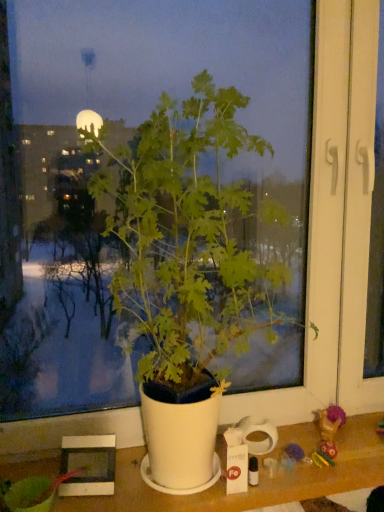
Describe the element at coordinates (188, 268) in the screenshot. I see `green matte plant at center` at that location.

This screenshot has width=384, height=512. I want to click on green matte plant at center, so click(188, 268).

In the scene shown: In order to face green matte plant at center, should I rotate leftwards or rightwards?

It's best to rotate right around 2.167 degrees.

Where is `green matte plant at center`? This screenshot has height=512, width=384. green matte plant at center is located at coordinates (188, 268).